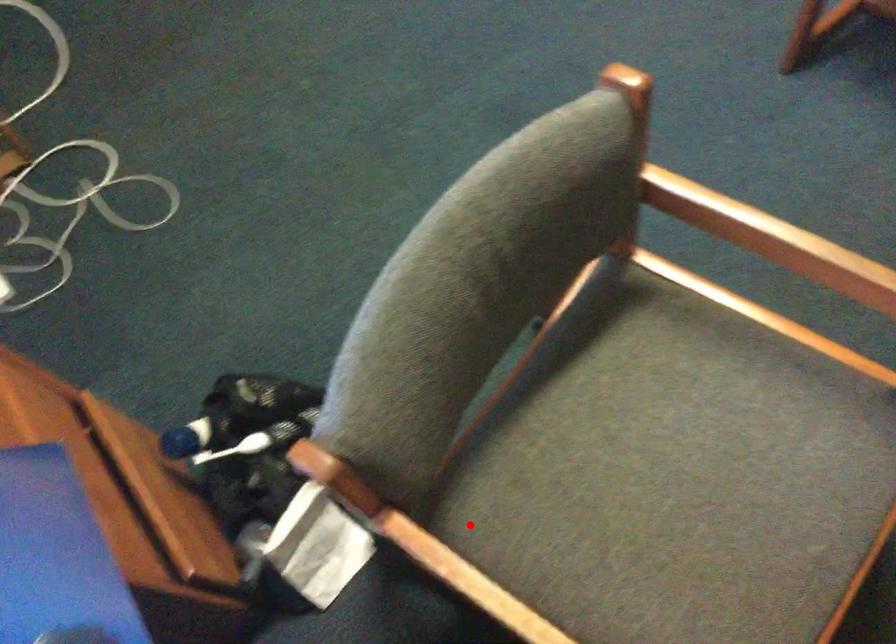
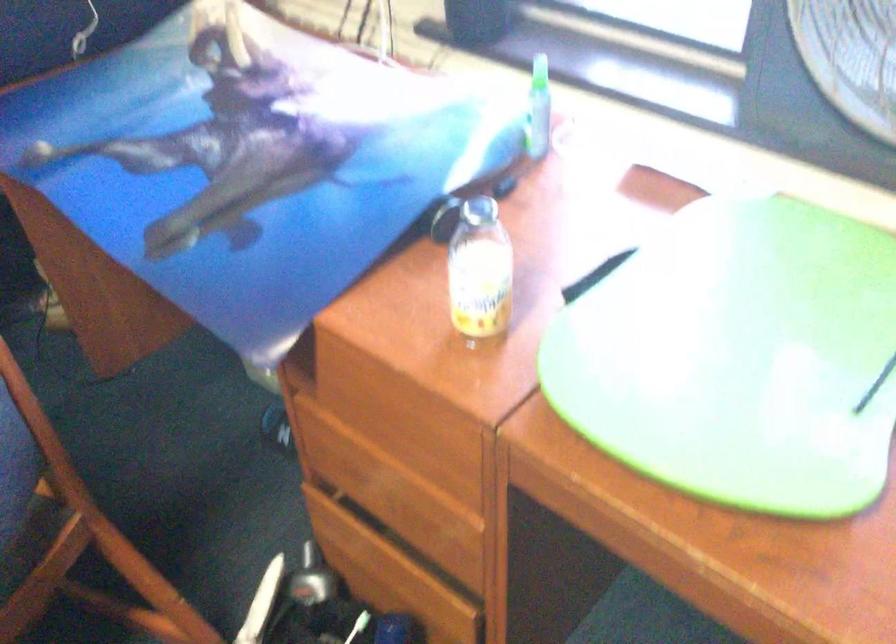
Question: I am providing you with two images of the same scene from different viewpoints. Image1 has a red point marked. In image2, the corresponding 3D location appears at what relative position? Reply with the corresponding letter.

Choices:
 (A) Closer
 (B) Farther

Answer: (B)